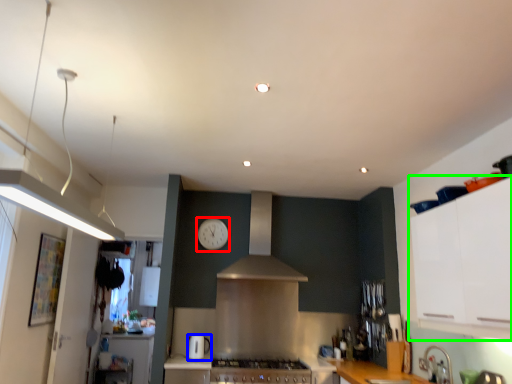
Question: Which object is positioned closest to clock (highlighted by a red box)? Select from kitchen appliance (highlighted by a blue box) and cabinetry (highlighted by a green box).

Choices:
 (A) kitchen appliance
 (B) cabinetry

Answer: (A)